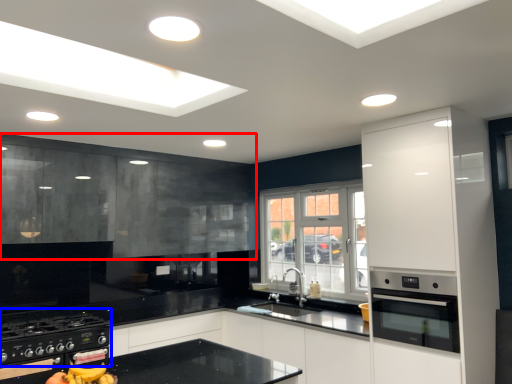
Question: Among these objects, which one is farthest to the camera, cabinetry (highlighted by a red box) or gas stove (highlighted by a blue box)?

Choices:
 (A) cabinetry
 (B) gas stove

Answer: (A)